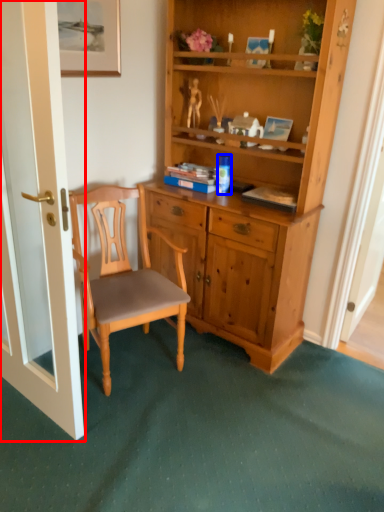
Question: Among these objects, which one is farthest to the camera, door (highlighted by a red box) or coffee cup (highlighted by a blue box)?

Choices:
 (A) door
 (B) coffee cup

Answer: (B)